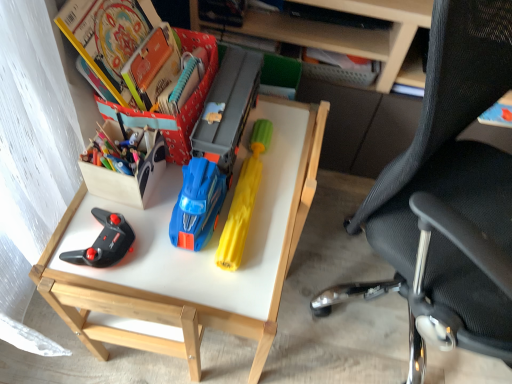
Locate an element on the screen. This screenshot has width=512, height=384. free point above matte paper book at upper left, placed as the first book when sorted from back to front (from a real-world perspective) is located at coordinates (170, 71).